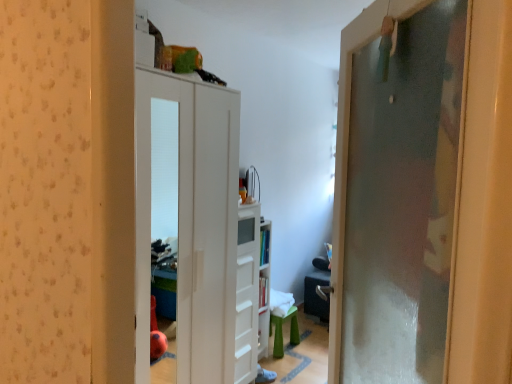
Question: From the image's perspective, relative to green plastic stool at lower center, is frosted glass door at right, the second door in the back-to-front sequence, above or below?

Choices:
 (A) below
 (B) above

Answer: (B)

Question: Would you say frosted glass door at right, the second door when ordered from left to right, is to the left or to the right of green plastic stool at lower center in the picture?

Choices:
 (A) left
 (B) right

Answer: (B)

Question: Considering the real-world distances, which object is farthest from the white glossy dresser at center?

Choices:
 (A) frosted glass door at right, the second door when ordered from left to right
 (B) green plastic stool at lower center
 (C) white matte cabinet at center, the second door viewed from the right
 (D) white plastic bookshelf at center

Answer: (A)

Question: Considering the real-world distances, which object is farthest from the white matte cabinet at center, the second door in the front-to-back sequence?

Choices:
 (A) green plastic stool at lower center
 (B) frosted glass door at right, arranged as the 1th door when viewed from the front
 (C) white glossy dresser at center
 (D) white plastic bookshelf at center

Answer: (A)